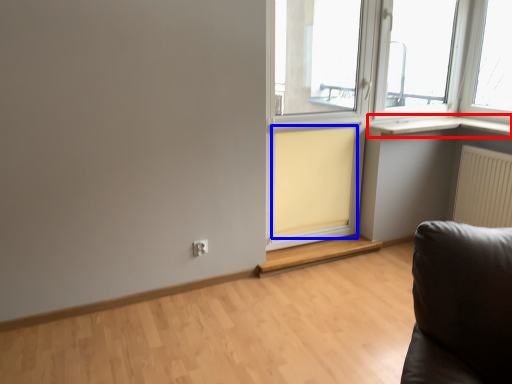
Question: Which object is further to the camera taking this photo, window sill (highlighted by a red box) or curtain (highlighted by a blue box)?

Choices:
 (A) window sill
 (B) curtain

Answer: (A)